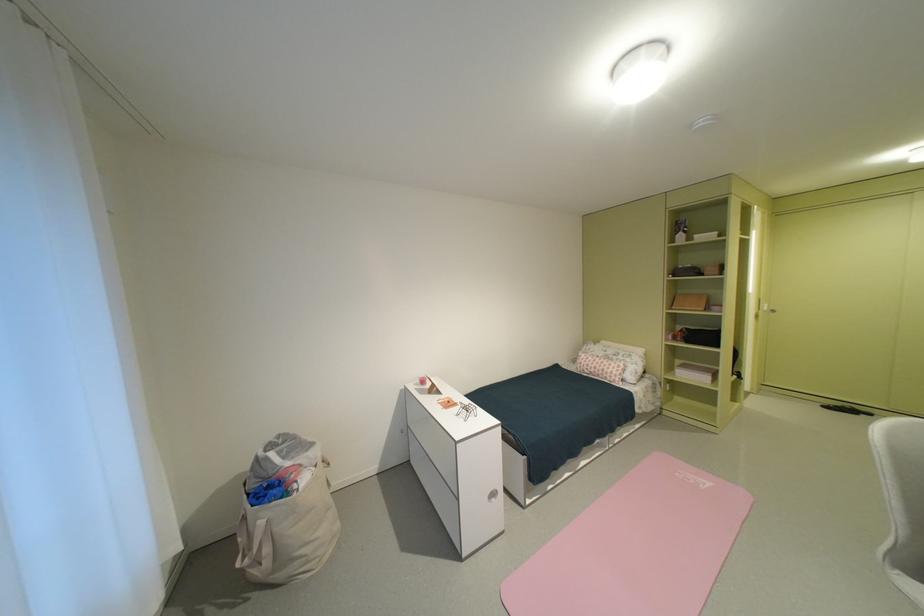
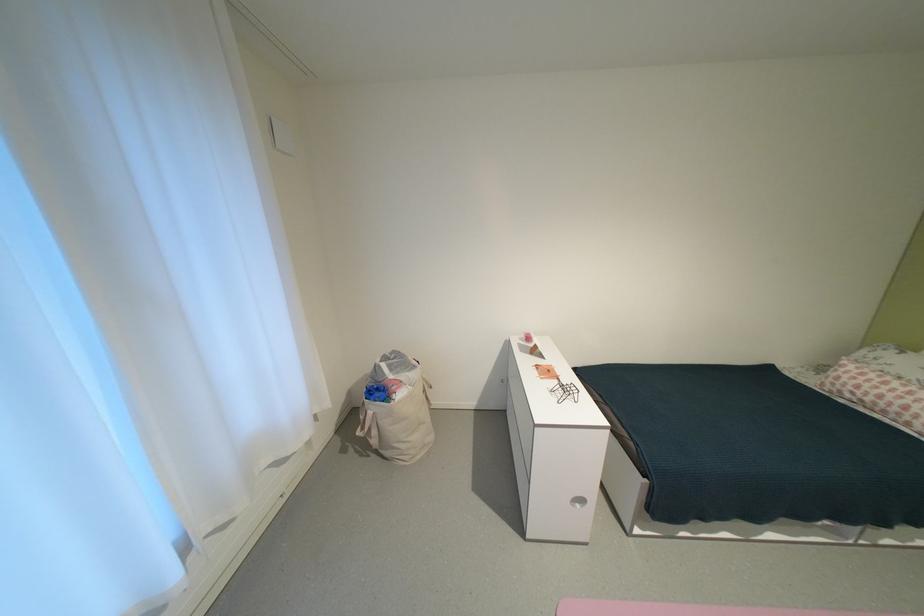
Find the pixel in the second image that matches (503,500) in the first image.

(588, 506)